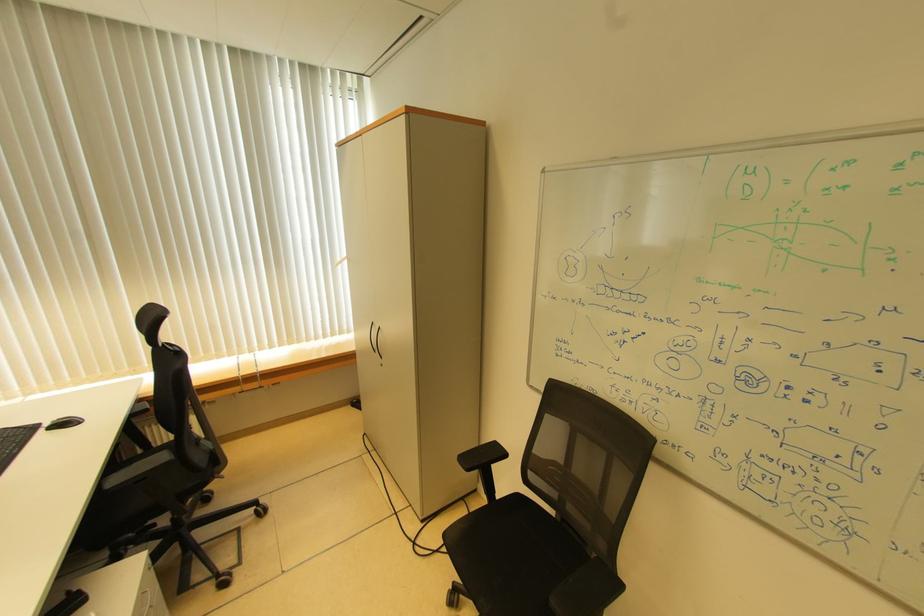
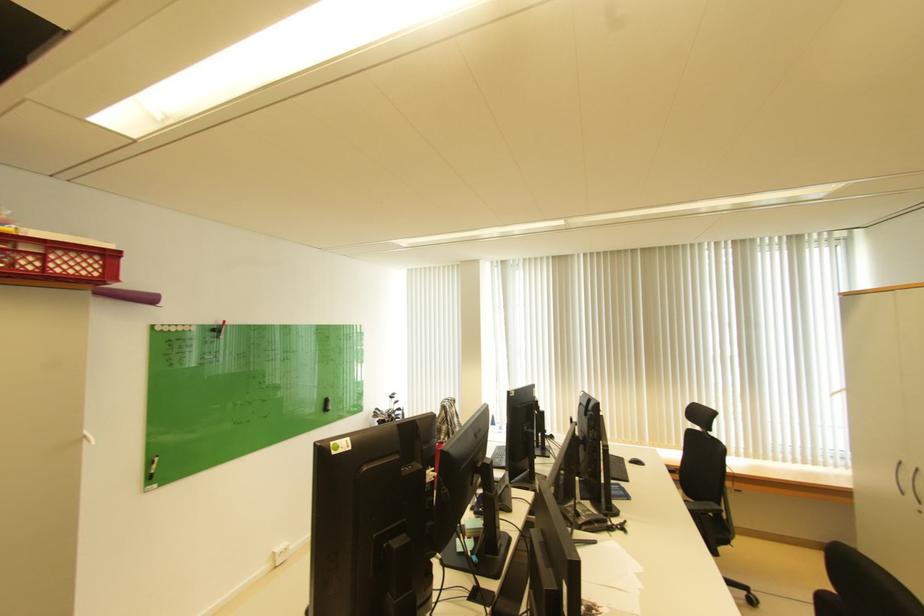
In the second image, find the point that corresponds to [55,426] in the first image.

(638, 461)